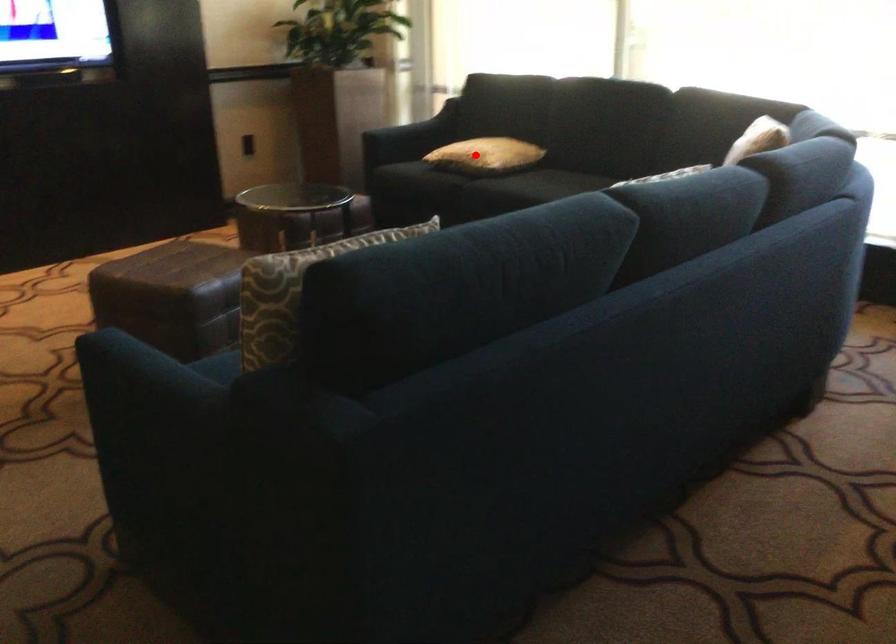
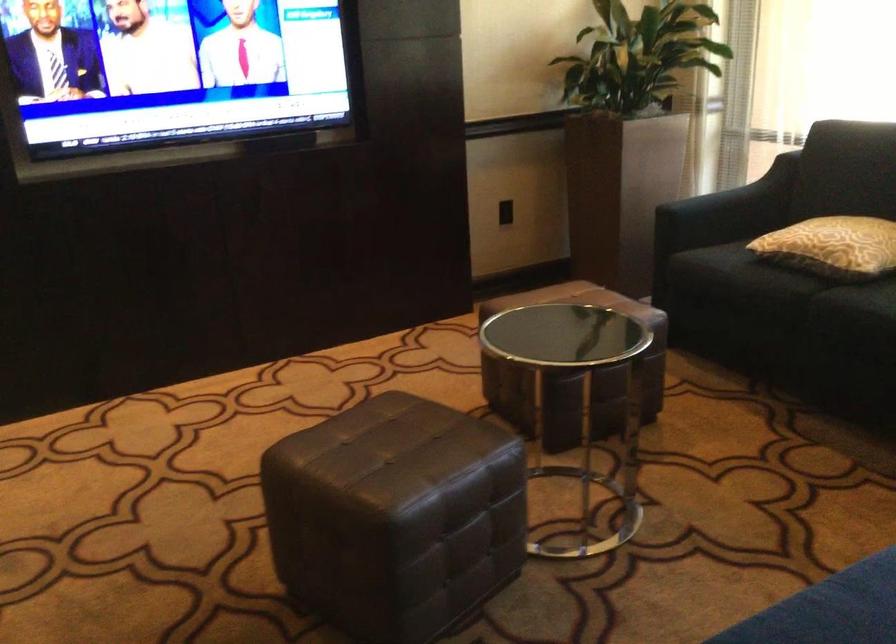
Question: A red point is marked in image1. In image2, is the corresponding 3D point closer to the camera or farther? Reply with the corresponding letter.

Choices:
 (A) The corresponding 3D point is closer.
 (B) The corresponding 3D point is farther.

Answer: (A)